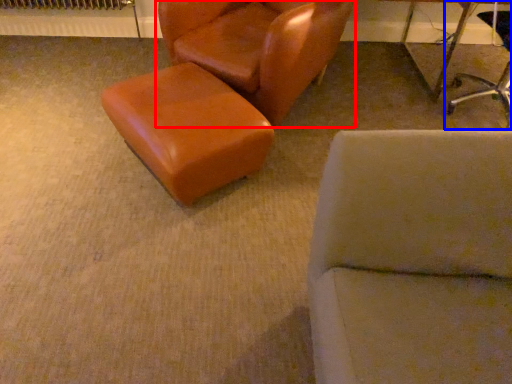
Question: Which object is further to the camera taking this photo, chair (highlighted by a red box) or chair (highlighted by a blue box)?

Choices:
 (A) chair
 (B) chair

Answer: (B)